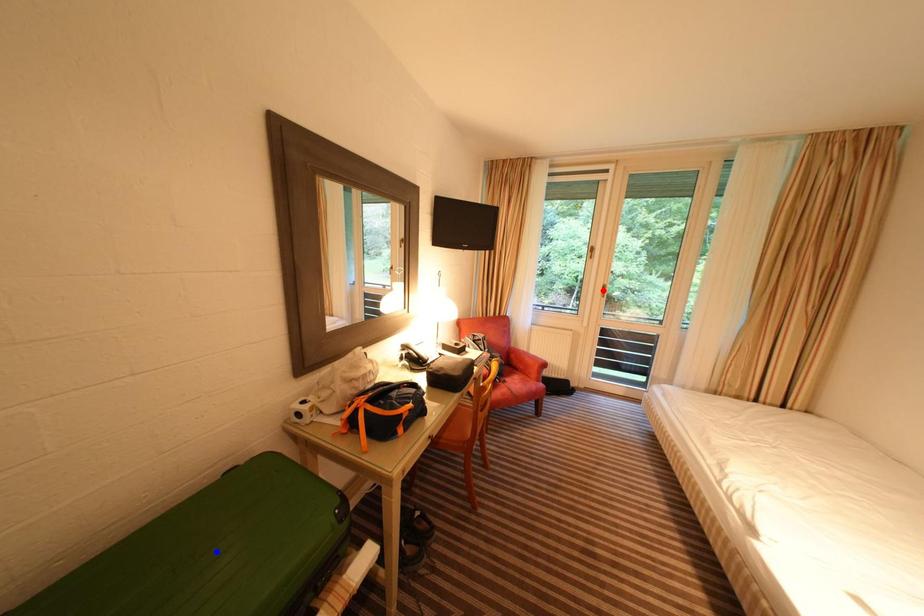
Question: Which of the two points in the image is closer to the camera?

Choices:
 (A) Blue point is closer.
 (B) Red point is closer.

Answer: (A)